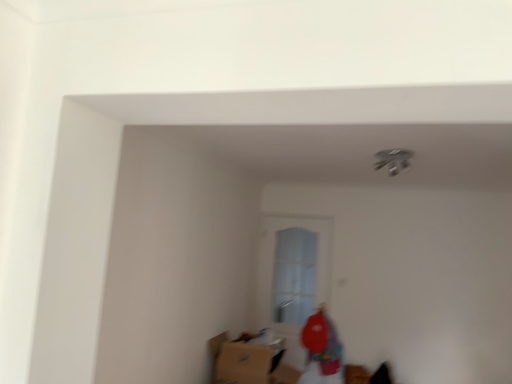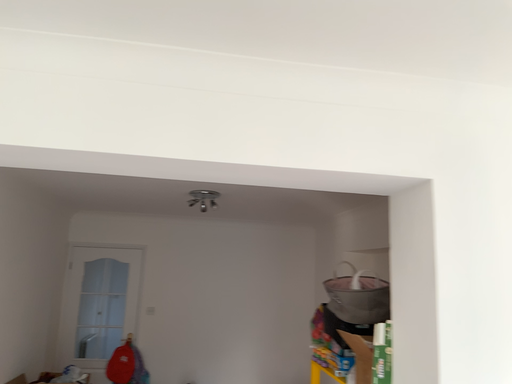
Question: How did the camera likely rotate when shooting the video?

Choices:
 (A) rotated left
 (B) rotated right

Answer: (B)